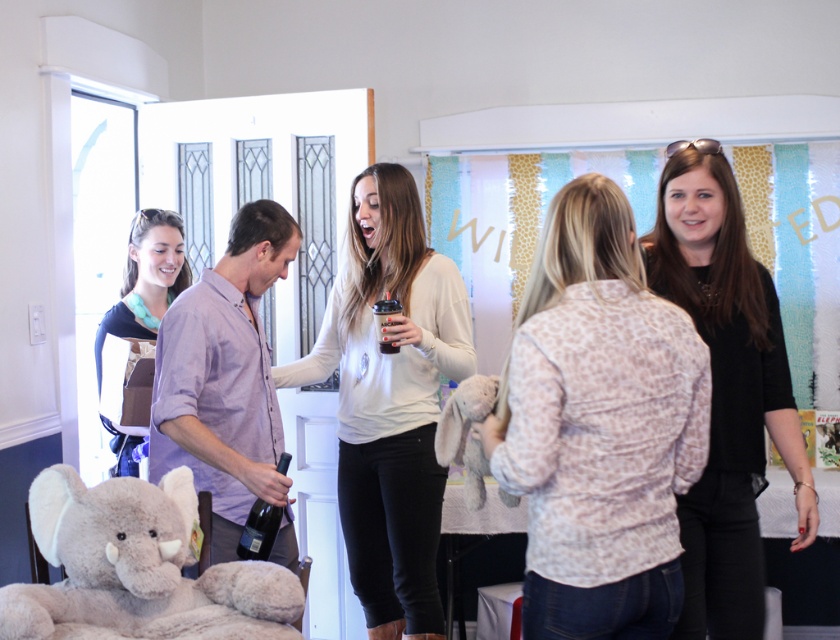
From the picture: You are standing in the room and want to hand a gift to the person wearing the leopard print blouse at center and the person in the matte black shirt at left. Which person should you approach first to ensure you can reach them without moving further into the room?

You should approach the leopard print blouse at center first because it is closer to you than the matte black shirt at left, so you can reach them without moving further into the room.

You are at a baby shower and need to place a gift on the table. The black matte shirt at right is above the soft plush elephant at lower left. Where should you place the gift so it won not be blocked by the shirt or the elephant?

Place the gift to the side of both the black matte shirt at right and the soft plush elephant at lower left, ensuring it is not under either object. Since the black matte shirt at right is above the soft plush elephant at lower left, positioning it to the side would keep it visible and unobstructed.